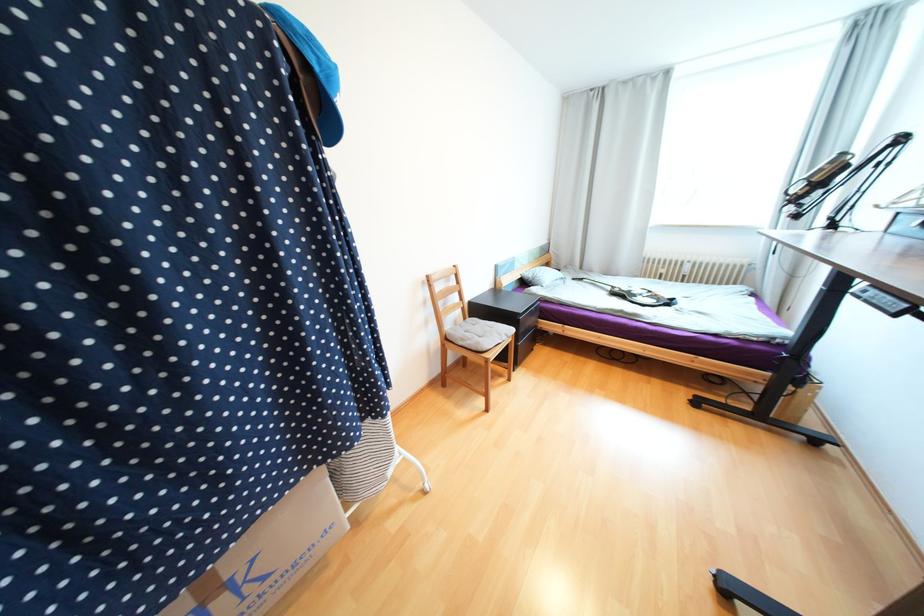
Which object does [641,297] point to?

It refers to a black guitar controller.